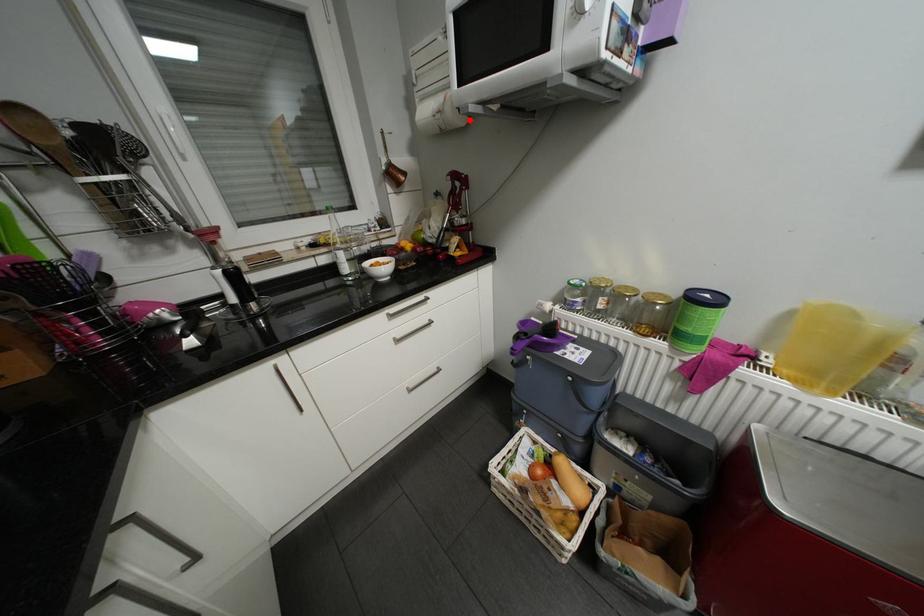
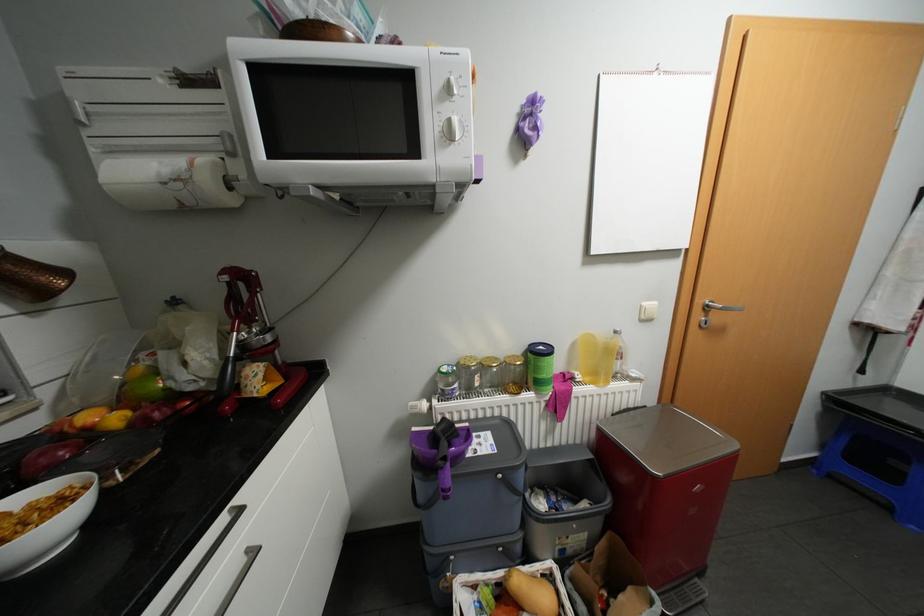
Question: A red point is marked in image1. In image2, is the corresponding 3D point closer to the camera or farther? Reply with the corresponding letter.

Choices:
 (A) The corresponding 3D point is closer.
 (B) The corresponding 3D point is farther.

Answer: (B)